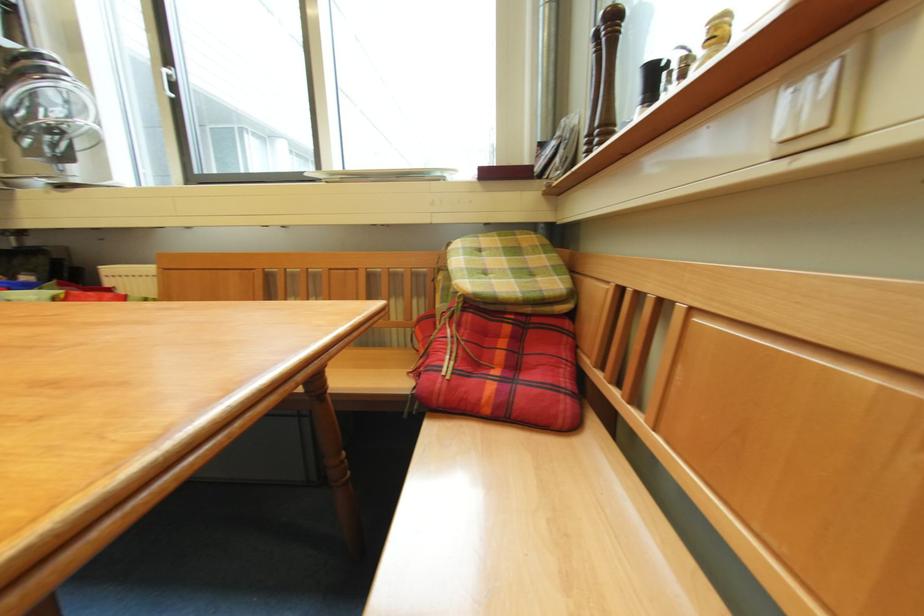
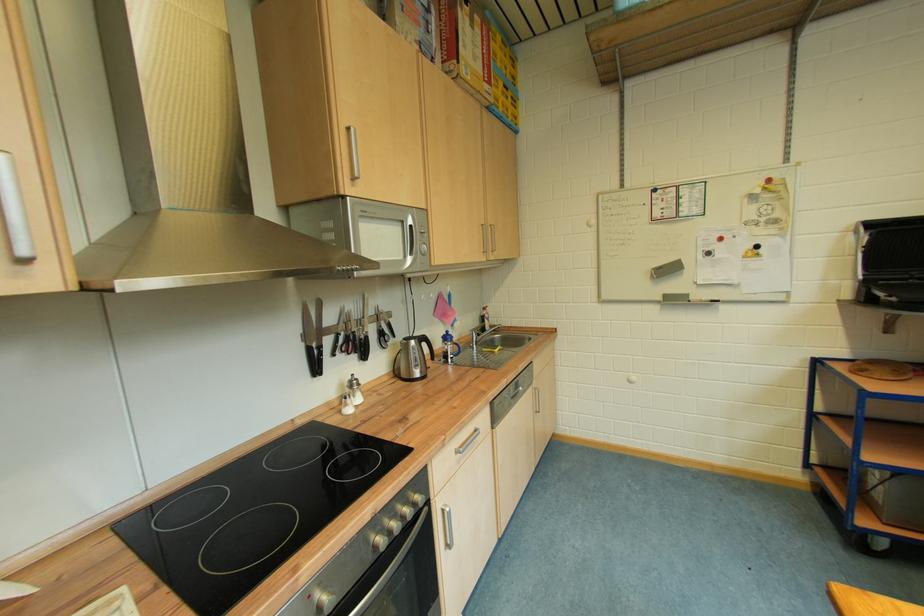
Question: Based on the continuous images, in which direction is the camera rotating? Reply with the corresponding letter.

Choices:
 (A) Left
 (B) Right
 (C) Up
 (D) Down

Answer: (A)